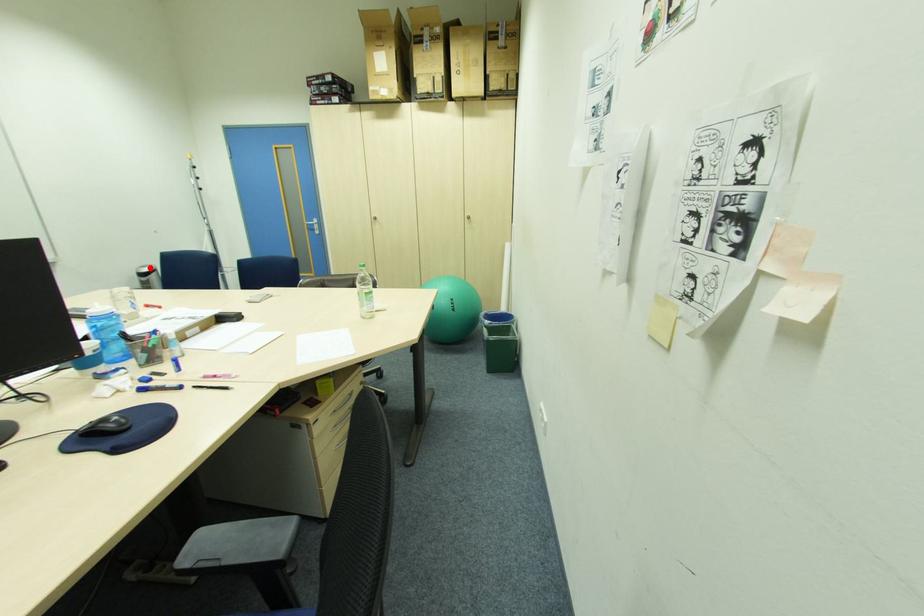
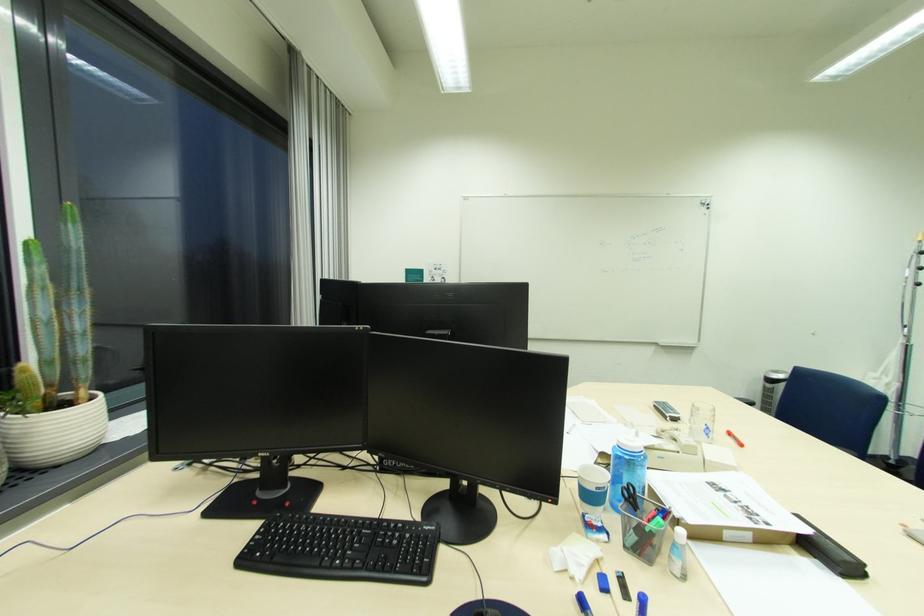
In the second image, find the point that corresponds to the highlighted location in the first image.

(782, 373)